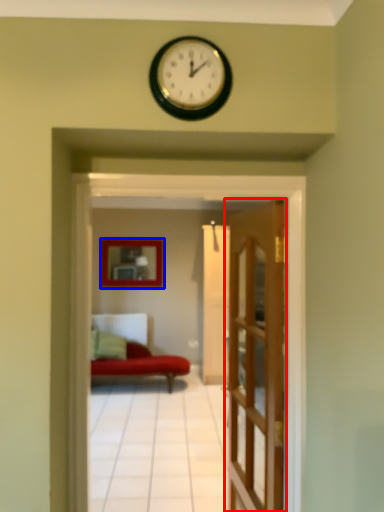
Question: Which object appears closest to the camera in this image, door (highlighted by a red box) or picture frame (highlighted by a blue box)?

Choices:
 (A) door
 (B) picture frame

Answer: (A)